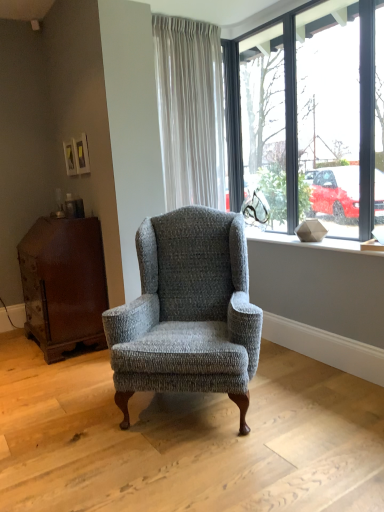
Question: From the image's perspective, is textured gray wingback chair at center on top of dark brown wood dresser at left?

Choices:
 (A) no
 (B) yes

Answer: (A)

Question: Is textured gray wingback chair at center shorter than dark brown wood dresser at left?

Choices:
 (A) yes
 (B) no

Answer: (B)

Question: Does textured gray wingback chair at center have a greater height compared to dark brown wood dresser at left?

Choices:
 (A) no
 (B) yes

Answer: (B)

Question: Is dark brown wood dresser at left inside textured gray wingback chair at center?

Choices:
 (A) yes
 (B) no

Answer: (B)

Question: Is textured gray wingback chair at center completely or partially outside of dark brown wood dresser at left?

Choices:
 (A) no
 (B) yes

Answer: (B)

Question: Considering the positions of clear glass window at upper right and textured gray wingback chair at center in the image, is clear glass window at upper right taller or shorter than textured gray wingback chair at center?

Choices:
 (A) tall
 (B) short

Answer: (A)

Question: Visually, is clear glass window at upper right positioned to the left or to the right of textured gray wingback chair at center?

Choices:
 (A) right
 (B) left

Answer: (A)

Question: Is point (258, 67) positioned closer to the camera than point (243, 365)?

Choices:
 (A) farther
 (B) closer

Answer: (A)

Question: From a real-world perspective, is clear glass window at upper right positioned above or below textured gray wingback chair at center?

Choices:
 (A) below
 (B) above

Answer: (B)

Question: Is dark brown wood dresser at left wider or thinner than textured gray wingback chair at center?

Choices:
 (A) thin
 (B) wide

Answer: (A)

Question: Is point (48, 236) closer or farther from the camera than point (187, 323)?

Choices:
 (A) farther
 (B) closer

Answer: (A)

Question: From a real-world perspective, is dark brown wood dresser at left positioned above or below textured gray wingback chair at center?

Choices:
 (A) below
 (B) above

Answer: (A)

Question: Considering the positions of dark brown wood dresser at left and textured gray wingback chair at center in the image, is dark brown wood dresser at left bigger or smaller than textured gray wingback chair at center?

Choices:
 (A) big
 (B) small

Answer: (B)

Question: Based on their sizes in the image, would you say matte gray stone at upper right is bigger or smaller than textured gray wingback chair at center?

Choices:
 (A) big
 (B) small

Answer: (B)

Question: From the image's perspective, is matte gray stone at upper right positioned above or below textured gray wingback chair at center?

Choices:
 (A) above
 (B) below

Answer: (A)